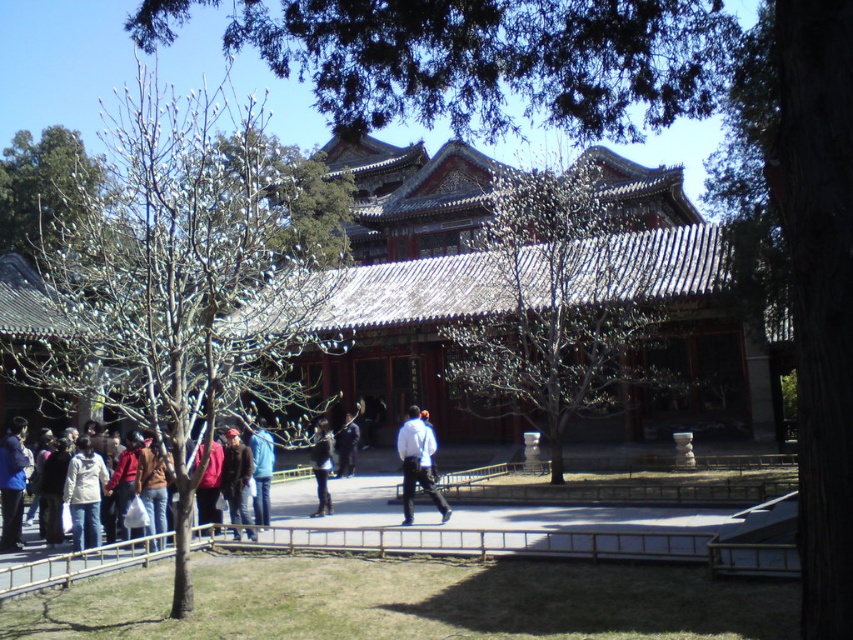
Question: Does brown wooden palace at center appear over brown leather jacket at center?

Choices:
 (A) no
 (B) yes

Answer: (B)

Question: Which object is the farthest from the brown wooden palace at center?

Choices:
 (A) black matte jacket at center
 (B) white shirt at center
 (C) bare branches at left
 (D) multicolored clothing at lower left

Answer: (D)

Question: Does white textured tree at center have a greater width compared to black matte jacket at center?

Choices:
 (A) no
 (B) yes

Answer: (B)

Question: Is brown wooden palace at center thinner than black matte jacket at center?

Choices:
 (A) yes
 (B) no

Answer: (B)

Question: Which point is farther from the camera taking this photo?

Choices:
 (A) (561, 438)
 (B) (619, 429)

Answer: (B)

Question: Which object is positioned farthest from the bare branches at left?

Choices:
 (A) blue denim jeans at center
 (B) multicolored clothing at lower left
 (C) green leafy tree at upper left

Answer: (B)